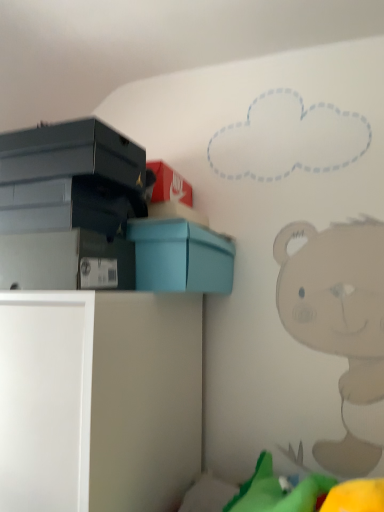
Question: From a real-world perspective, is matte blue box at upper left positioned above or below white matte cabinet at lower left?

Choices:
 (A) below
 (B) above

Answer: (B)

Question: From the image's perspective, is matte blue box at upper left located above or below white matte cabinet at lower left?

Choices:
 (A) above
 (B) below

Answer: (A)

Question: Based on their relative distances, which object is nearer to the white matte cabinet at lower left?

Choices:
 (A) matte blue box at upper left
 (B) matte gray storage box at lower left

Answer: (B)

Question: Which of these objects is positioned farthest from the matte blue box at upper left?

Choices:
 (A) matte gray storage box at lower left
 (B) white matte cabinet at lower left

Answer: (B)